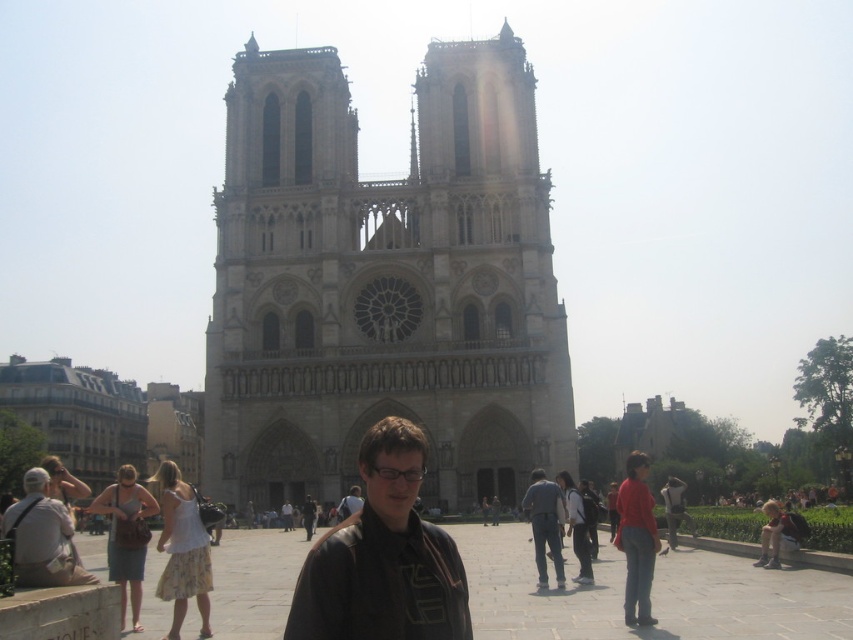
Question: Among these objects, which one is farthest from the camera?

Choices:
 (A) matte brown jacket at center
 (B) denim jeans at center

Answer: (A)

Question: Where is gray stone cathedral at center located in relation to matte brown jacket at center in the image?

Choices:
 (A) below
 (B) above

Answer: (B)

Question: Is gray stone cathedral at center to the left of light gray fabric bag at lower left from the viewer's perspective?

Choices:
 (A) yes
 (B) no

Answer: (B)

Question: Based on their relative distances, which object is nearer to the light gray fabric bag at lower left?

Choices:
 (A) denim jeans at center
 (B) gray stone cathedral at center
 (C) black matte jacket at center

Answer: (C)

Question: Which of these objects is positioned closest to the black matte jacket at center?

Choices:
 (A) matte brown jacket at center
 (B) light gray fabric bag at lower left
 (C) denim jeans at center

Answer: (C)

Question: Is black matte jacket at center further to camera compared to light gray fabric bag at lower left?

Choices:
 (A) no
 (B) yes

Answer: (A)